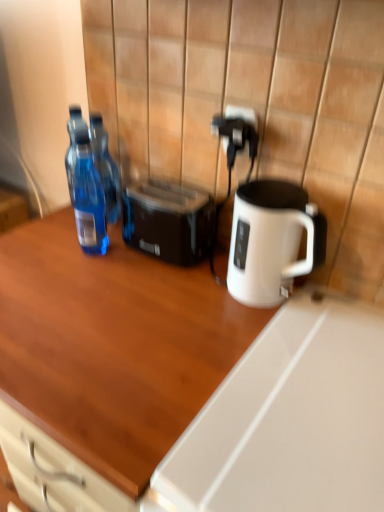
Image resolution: width=384 pixels, height=512 pixels. I want to click on vacant space in front of transparent plastic bottle at left, the second bottle positioned from the back, so click(x=87, y=293).